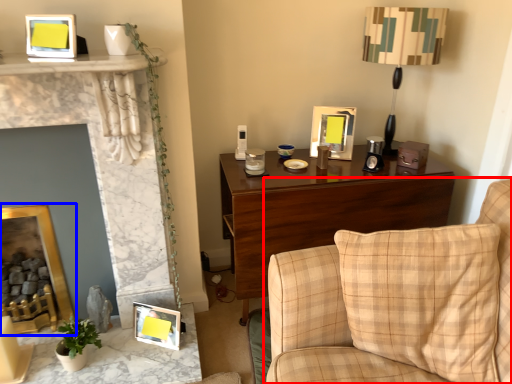
Question: Which of the following is the farthest to the observer, studio couch (highlighted by a red box) or picture frame (highlighted by a blue box)?

Choices:
 (A) studio couch
 (B) picture frame

Answer: (B)